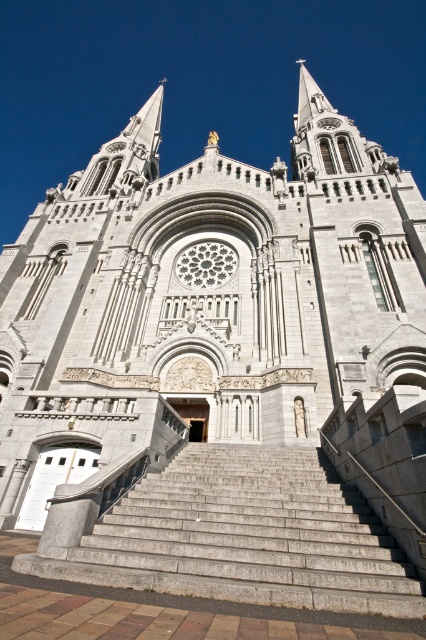
Question: Can you confirm if gray stone church at center is positioned above gray concrete stairs at center?

Choices:
 (A) no
 (B) yes

Answer: (B)

Question: Does gray stone church at center lie behind gray concrete stairs at center?

Choices:
 (A) no
 (B) yes

Answer: (B)

Question: Is gray stone church at center thinner than gray concrete stairs at center?

Choices:
 (A) no
 (B) yes

Answer: (A)